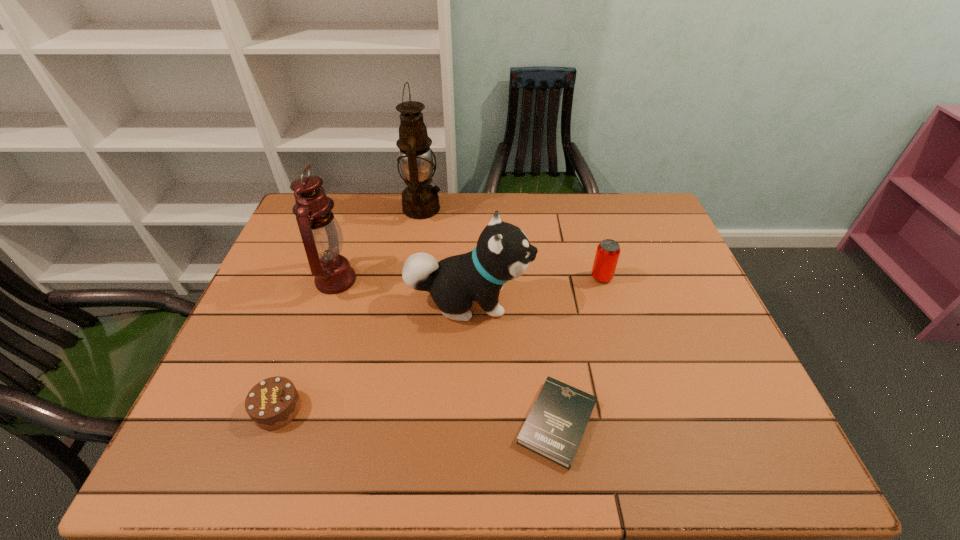
Image resolution: width=960 pixels, height=540 pixels. I want to click on vacant point located between the book and the can, so [x=580, y=350].

In order to click on free space that is in between the nearer oil lamp and the farthest object in this screenshot , I will do `click(379, 244)`.

Find the location of a particular element. This screenshot has height=540, width=960. free space between the fourth tallest object and the shortest object is located at coordinates (580, 350).

Where is `vacant space that's between the right oil lamp and the book`? vacant space that's between the right oil lamp and the book is located at coordinates (490, 315).

You are a GUI agent. You are given a task and a screenshot of the screen. Output one action in this format:
    pyautogui.click(x=<x>, y=<y>)
    Task: Click on the object that is the nearest to the book
    The width and height of the screenshot is (960, 540).
    Given the screenshot: What is the action you would take?
    pyautogui.click(x=503, y=252)

Identify the location of object that stands as the third closest to the fourth shortest object. The width and height of the screenshot is (960, 540). (607, 254).

Identify the location of blank space that satisfies the following two spatial constraints: 1. on the back side of the rightmost object; 2. on the right side of the shortest object. (538, 277).

What are the coordinates of `vacant space that satisfies the following two spatial constraints: 1. on the back side of the book; 2. at the face of the third tallest object` in the screenshot? It's located at (540, 301).

Identify the location of free point that satisfies the following two spatial constraints: 1. on the back side of the chocolate cake; 2. on the right side of the fifth shortest object. This screenshot has width=960, height=540. (324, 280).